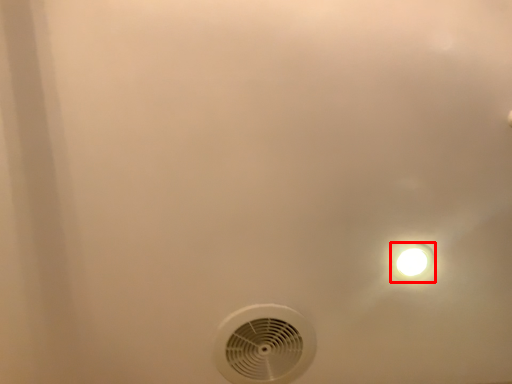
Question: From the image's perspective, what is the correct spatial positioning of light fixture (annotated by the red box) in reference to mechanical fan?

Choices:
 (A) below
 (B) above

Answer: (B)